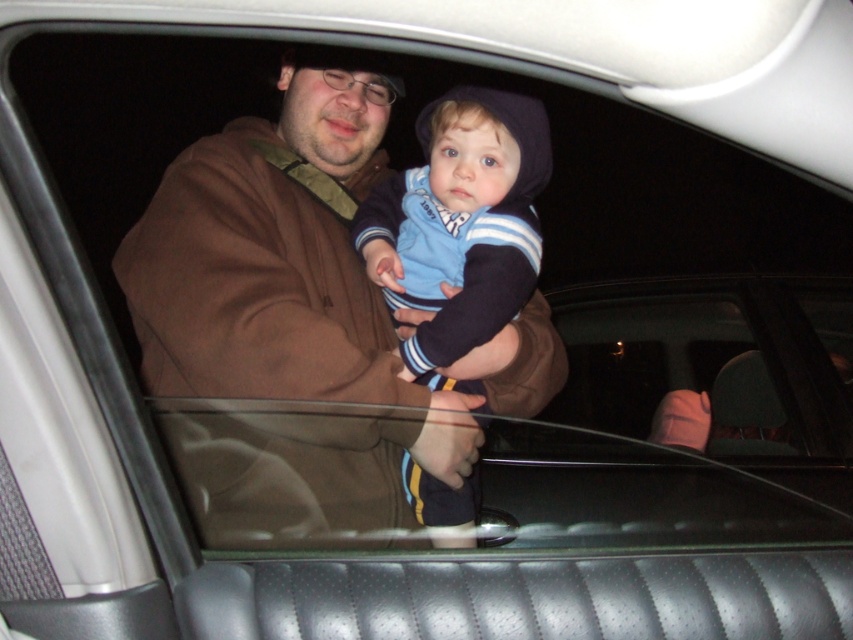
Question: Is brown fleece jacket at center thinner than blue striped sweater at center?

Choices:
 (A) yes
 (B) no

Answer: (B)

Question: Can you confirm if brown fleece jacket at center is positioned to the left of blue striped sweater at center?

Choices:
 (A) no
 (B) yes

Answer: (B)

Question: Can you confirm if brown fleece jacket at center is wider than blue striped sweater at center?

Choices:
 (A) yes
 (B) no

Answer: (A)

Question: Which point is farther from the camera taking this photo?

Choices:
 (A) (387, 106)
 (B) (515, 218)

Answer: (A)

Question: Which point is farther to the camera?

Choices:
 (A) blue striped sweater at center
 (B) brown fleece jacket at center

Answer: (A)